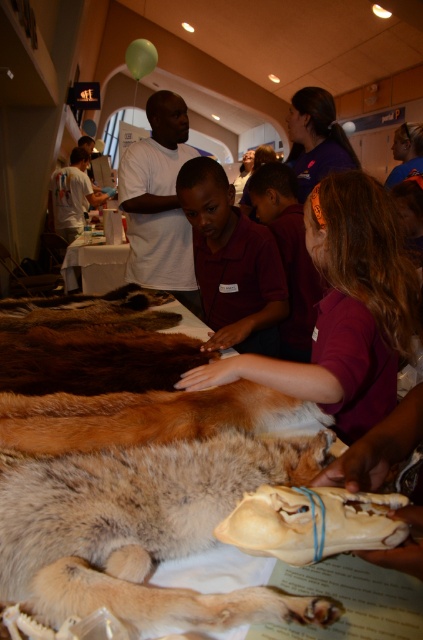
Question: Can you confirm if fluffy fur dog at center is wider than purple shirt at center?

Choices:
 (A) yes
 (B) no

Answer: (A)

Question: Which object is positioned farthest from the white t-shirt at left?

Choices:
 (A) fluffy fur dog at center
 (B) purple shirt at center

Answer: (A)

Question: Which object is positioned farthest from the white t-shirt at left?

Choices:
 (A) fluffy fur dog at center
 (B) purple shirt at center

Answer: (A)

Question: Can you confirm if purple shirt at center is thinner than white t-shirt at left?

Choices:
 (A) no
 (B) yes

Answer: (B)

Question: Can you confirm if fluffy fur dog at center is positioned below purple shirt at center?

Choices:
 (A) no
 (B) yes

Answer: (B)

Question: Which of the following is the closest to the observer?

Choices:
 (A) (269, 243)
 (B) (65, 518)
 (C) (51, 209)

Answer: (B)